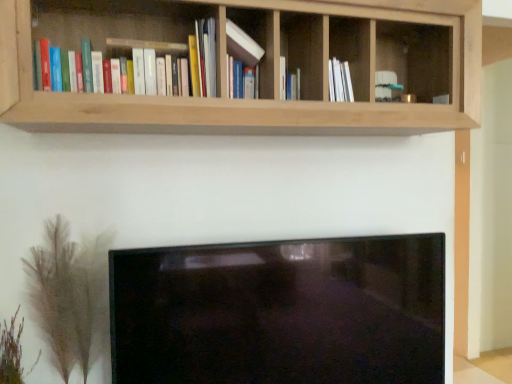
Question: Is matte white book at center, which is the first book from right to left, completely or partially inside green fuzzy plant at lower left, the second plant in the left-to-right sequence?

Choices:
 (A) yes
 (B) no

Answer: (B)

Question: Is green fuzzy plant at lower left, the second plant in the left-to-right sequence, thinner than matte white book at center, which is the first book from right to left?

Choices:
 (A) yes
 (B) no

Answer: (B)

Question: From the image's perspective, would you say green fuzzy plant at lower left, the second plant in the left-to-right sequence, is positioned over matte white book at center, which is the first book from right to left?

Choices:
 (A) yes
 (B) no

Answer: (B)

Question: Can you confirm if green fuzzy plant at lower left, acting as the first plant starting from the right, is taller than matte white book at center, which is the first book from right to left?

Choices:
 (A) no
 (B) yes

Answer: (B)

Question: From a real-world perspective, is green fuzzy plant at lower left, acting as the first plant starting from the right, positioned over matte white book at center, which is the first book from right to left, based on gravity?

Choices:
 (A) yes
 (B) no

Answer: (B)

Question: Can you confirm if green fuzzy plant at lower left, the second plant in the left-to-right sequence, is wider than matte white book at center, which is the first book from right to left?

Choices:
 (A) yes
 (B) no

Answer: (A)

Question: Can you see natural wood shelf at upper center touching matte white book at center, which is the first book from right to left?

Choices:
 (A) no
 (B) yes

Answer: (A)

Question: Considering the relative sizes of natural wood shelf at upper center and matte white book at center, which ranks as the 2th book in left-to-right order, in the image provided, is natural wood shelf at upper center smaller than matte white book at center, which ranks as the 2th book in left-to-right order,?

Choices:
 (A) yes
 (B) no

Answer: (B)

Question: Is matte white book at center, which ranks as the 2th book in left-to-right order, a part of natural wood shelf at upper center?

Choices:
 (A) yes
 (B) no

Answer: (A)

Question: Considering the relative positions of natural wood shelf at upper center and matte white book at center, which ranks as the 2th book in left-to-right order, in the image provided, is natural wood shelf at upper center to the right of matte white book at center, which ranks as the 2th book in left-to-right order, from the viewer's perspective?

Choices:
 (A) yes
 (B) no

Answer: (A)

Question: From a real-world perspective, is natural wood shelf at upper center located higher than matte white book at center, which is the first book from right to left?

Choices:
 (A) yes
 (B) no

Answer: (A)

Question: Could you tell me if natural wood shelf at upper center is turned towards matte white book at center, which ranks as the 2th book in left-to-right order?

Choices:
 (A) yes
 (B) no

Answer: (A)

Question: Is green feathery plant at lower left, which appears as the 2th plant when viewed from the right, far from natural wood shelf at upper center?

Choices:
 (A) yes
 (B) no

Answer: (A)